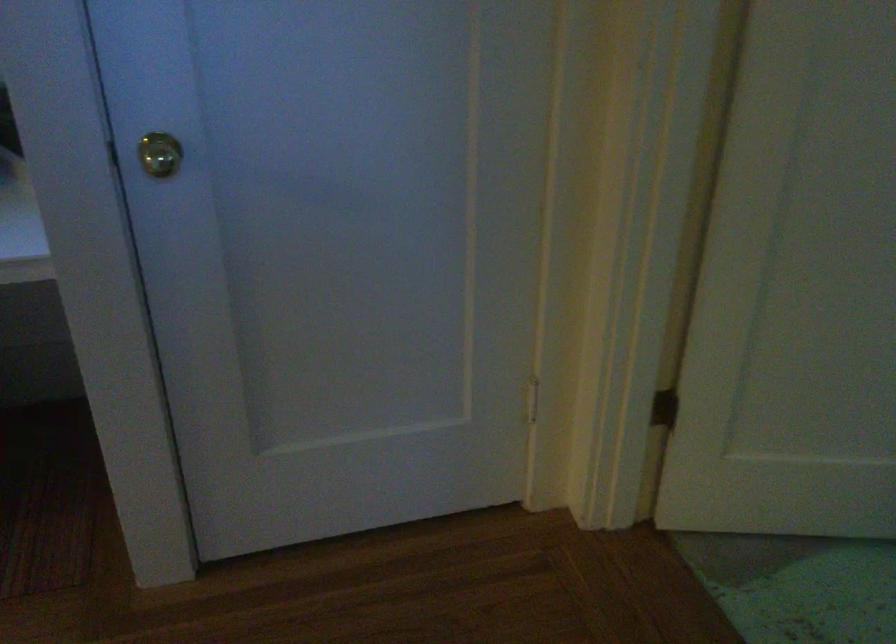
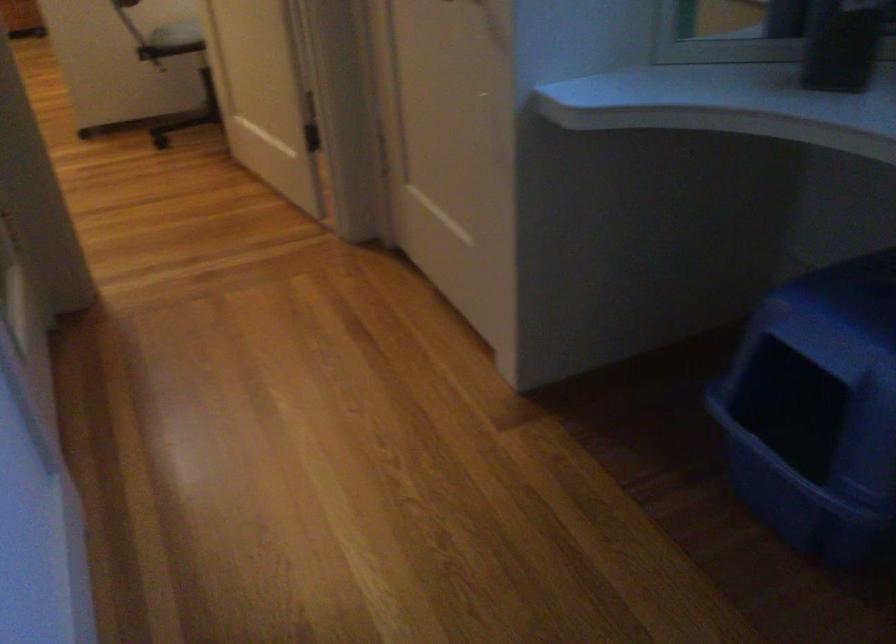
How did the camera likely rotate?

The rotation direction of the camera is left-down.